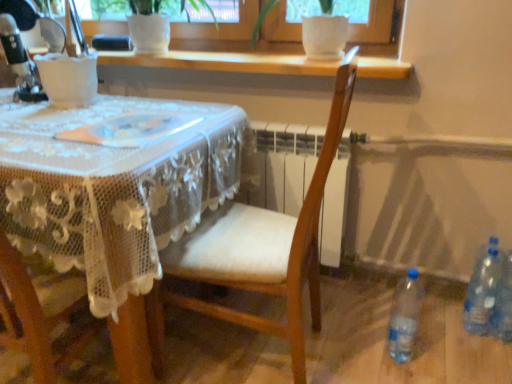
This screenshot has height=384, width=512. In order to click on vacant space situated on the left part of clear plastic bottle at lower right, which ranks as the second bottle in right-to-left order in this screenshot , I will do `click(431, 341)`.